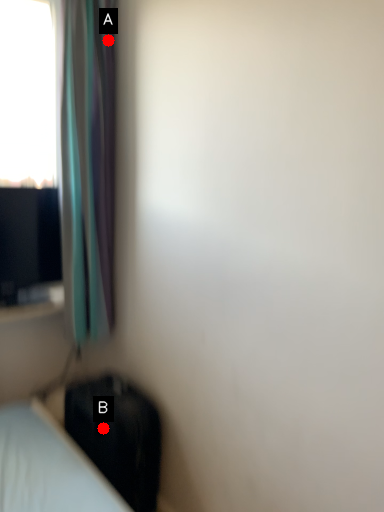
Question: Two points are circled on the image, labeled by A and B beside each circle. Which of the following is the farthest from the observer?

Choices:
 (A) A is further
 (B) B is further

Answer: (A)